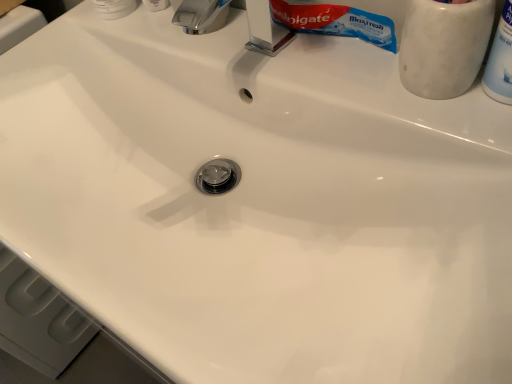
At what (x,y) coordinates should I click in order to perform the action: click on vacant space situated on the left part of white plastic toothpaste tube at upper left, which ranks as the first toiletry in left-to-right order. Please return your answer as a coordinate pair (x, y). Looking at the image, I should click on (61, 28).